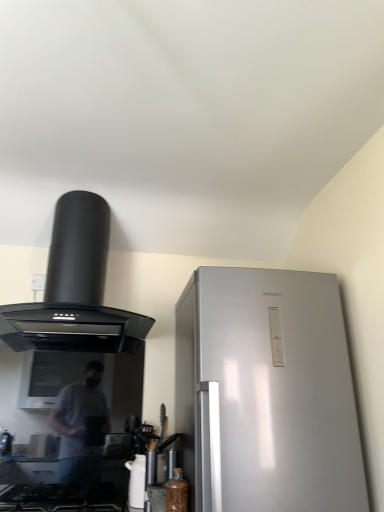
Question: Is black matte range hood at upper left situated inside translucent glass bottle at lower center or outside?

Choices:
 (A) outside
 (B) inside

Answer: (A)

Question: Considering the positions of point (105, 345) and point (185, 500), is point (105, 345) closer or farther from the camera than point (185, 500)?

Choices:
 (A) farther
 (B) closer

Answer: (A)

Question: Which of these objects is positioned farthest from the translucent glass bottle at lower center?

Choices:
 (A) black matte range hood at upper left
 (B) white glossy kettle at lower center
 (C) black glass gas stove at lower left

Answer: (A)

Question: Which of these objects is positioned farthest from the black matte range hood at upper left?

Choices:
 (A) black glass gas stove at lower left
 (B) white glossy kettle at lower center
 (C) translucent glass bottle at lower center

Answer: (C)